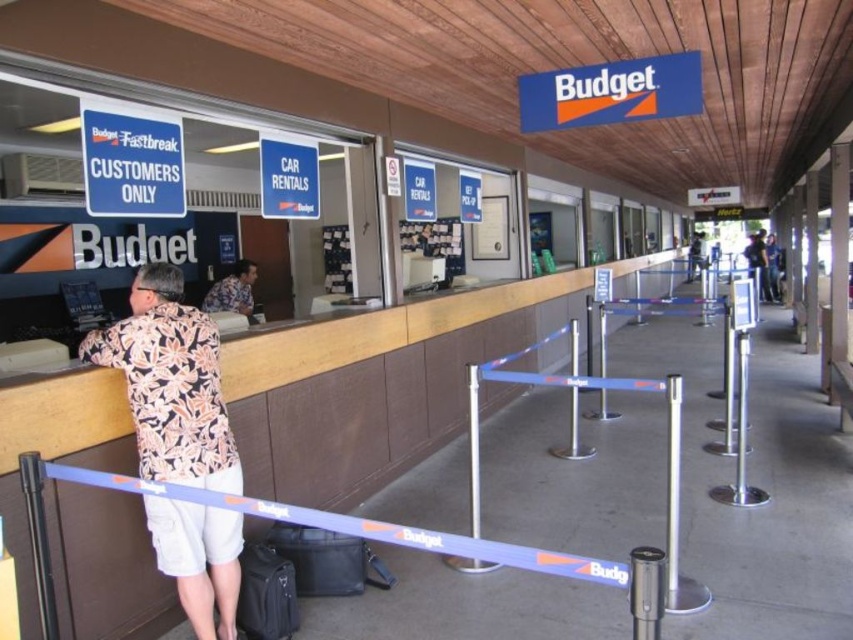
You are standing at the entrance of the Budget car rental counter. You need to locate the employee wearing the hawaiian print shirt at left. Where should you look relative to your position?

The hawaiian print shirt at left is located at the coordinates point 0.600 on the x axis and 0.200 on the y axis, so you should look to your left and slightly forward from your current position at the entrance.

Consider the image. You are a customer waiting at the Budget car rental counter. You have a black fabric suitcase at lower left and a floral shirt at center in your hand. The counter has a height of 1.2 meters. Can both items fit on the counter top simultaneously?

The black fabric suitcase at lower left is thinner than the floral shirt at center. However, the question of fitting both on the counter top depends on their combined width and the counter top width, which isn not provided. Thus, it is uncertain if both items can fit together on the counter top.